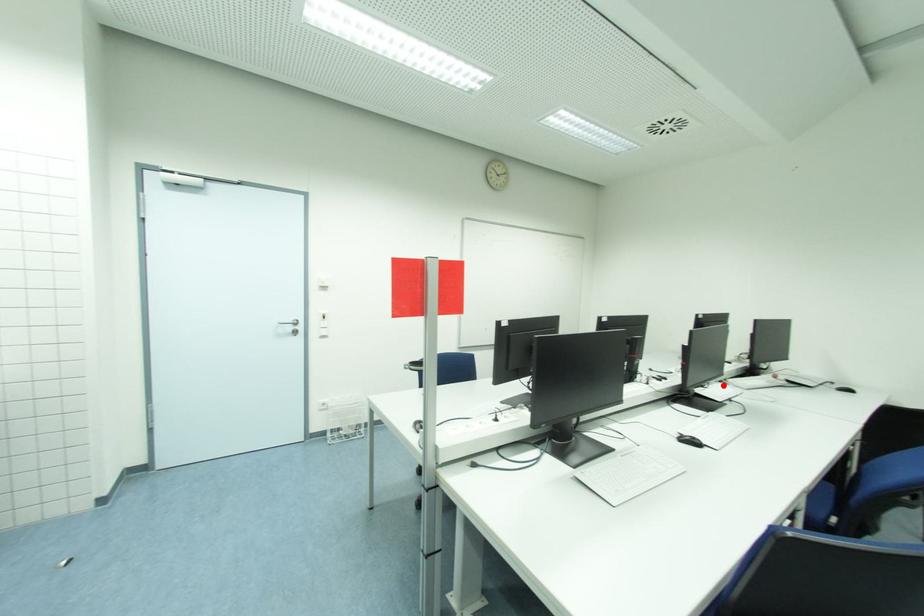
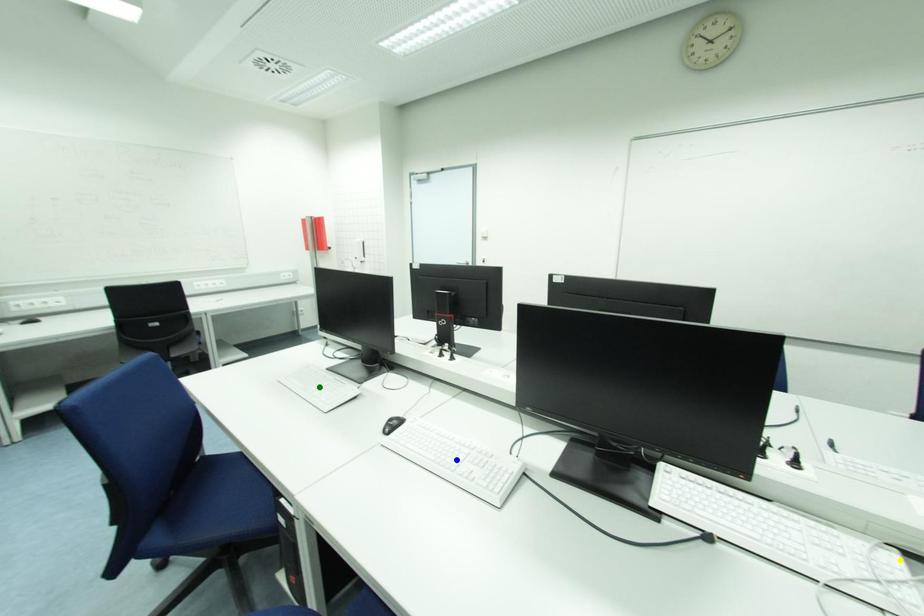
Question: I am providing you with two images of the same scene from different viewpoints. A red point is marked on the first image. You are given multiple points on the second image. Which point in image 2 represents the same 3d spot as the red point in image 1?

Choices:
 (A) green point
 (B) yellow point
 (C) blue point

Answer: (B)